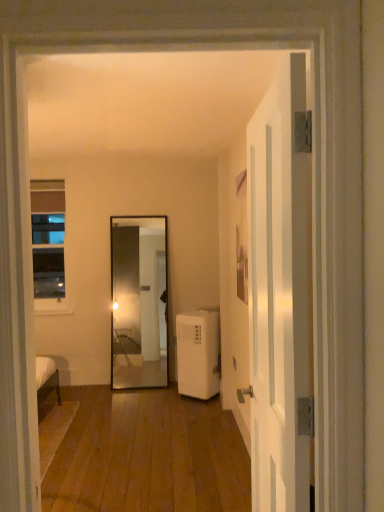
The image size is (384, 512). Describe the element at coordinates (281, 294) in the screenshot. I see `white glossy door at right` at that location.

The width and height of the screenshot is (384, 512). What are the coordinates of `white glossy door at right` in the screenshot? It's located at (281, 294).

Is white plastic air conditioner at lower right a part of white glossy door at right?

That's incorrect, white plastic air conditioner at lower right is not inside white glossy door at right.

Which of these two, white glossy door at right or white plastic air conditioner at lower right, is wider?

white plastic air conditioner at lower right.

Where is `air conditioner on the left of white glossy door at right`? This screenshot has width=384, height=512. air conditioner on the left of white glossy door at right is located at coordinates tap(198, 354).

Is white plastic air conditioner at lower right at the back of white glossy door at right?

No, white plastic air conditioner at lower right is not at the back of white glossy door at right.

From the image's perspective, which is below, white plastic air conditioner at lower right or clear glass window at left?

From the image's view, white plastic air conditioner at lower right is below.

Is white plastic air conditioner at lower right bigger than clear glass window at left?

Correct, white plastic air conditioner at lower right is larger in size than clear glass window at left.

Based on the photo, how much distance is there between white plastic air conditioner at lower right and clear glass window at left?

A distance of 5.40 feet exists between white plastic air conditioner at lower right and clear glass window at left.

Is the position of white plastic air conditioner at lower right less distant than that of clear glass window at left?

Yes.

Does white glossy door at right appear on the left side of clear glass window at left?

Incorrect, white glossy door at right is not on the left side of clear glass window at left.

Does white glossy door at right lie in front of clear glass window at left?

Yes, white glossy door at right is closer to the viewer.

From a real-world perspective, relative to clear glass window at left, is white glossy door at right vertically above or below?

In terms of real-world spatial position, white glossy door at right is below clear glass window at left.

Where is `door in front of the clear glass window at left`? door in front of the clear glass window at left is located at coordinates (281, 294).

Is white plastic air conditioner at lower right oriented away from white glossy door at right?

That's not correct — white plastic air conditioner at lower right is not looking away from white glossy door at right.

Choose the correct answer: Is white plastic air conditioner at lower right inside white glossy door at right or outside it?

white plastic air conditioner at lower right is outside white glossy door at right.

Is point (193, 318) farther from camera compared to point (257, 426)?

Yes.

In the image, there is a white plastic air conditioner at lower right. Where is `door above it (from the image's perspective)`? This screenshot has width=384, height=512. door above it (from the image's perspective) is located at coordinates (281, 294).

Is the depth of clear glass window at left greater than that of white plastic air conditioner at lower right?

Yes, it is.

In terms of height, does clear glass window at left look taller or shorter compared to white plastic air conditioner at lower right?

Considering their sizes, clear glass window at left has more height than white plastic air conditioner at lower right.

Based on their sizes in the image, would you say clear glass window at left is bigger or smaller than white plastic air conditioner at lower right?

Clearly, clear glass window at left is smaller in size than white plastic air conditioner at lower right.

In the image, is clear glass window at left on the left side or the right side of white plastic air conditioner at lower right?

From the image, it's evident that clear glass window at left is to the left of white plastic air conditioner at lower right.

Looking at this image, which object is positioned more to the left, clear glass window at left or white glossy door at right?

clear glass window at left.

Is clear glass window at left positioned far away from white glossy door at right?

Yes, clear glass window at left and white glossy door at right are quite far apart.

Does clear glass window at left have a lesser height compared to white glossy door at right?

Indeed, clear glass window at left has a lesser height compared to white glossy door at right.

From a real-world perspective, is clear glass window at left under white glossy door at right?

No, from a real-world perspective, clear glass window at left is not beneath white glossy door at right.

Locate an element on the screen. air conditioner below the white glossy door at right (from a real-world perspective) is located at coordinates (198, 354).

Find the location of a particular element. air conditioner lying on the right of clear glass window at left is located at coordinates (198, 354).

When comparing their distances from white glossy door at right, does clear glass window at left or white plastic air conditioner at lower right seem further?

Among the two, clear glass window at left is located further to white glossy door at right.

From the image, which object appears to be farther from white glossy door at right, white plastic air conditioner at lower right or clear glass window at left?

clear glass window at left is further to white glossy door at right.

Looking at the image, which one is located closer to white plastic air conditioner at lower right, clear glass window at left or white glossy door at right?

The object closer to white plastic air conditioner at lower right is clear glass window at left.

Considering their positions, is white glossy door at right positioned further to clear glass window at left than white plastic air conditioner at lower right?

white glossy door at right.

From the image, which object appears to be nearer to white plastic air conditioner at lower right, white glossy door at right or clear glass window at left?

clear glass window at left.

Considering their positions, is white plastic air conditioner at lower right positioned closer to clear glass window at left than white glossy door at right?

Among the two, white plastic air conditioner at lower right is located nearer to clear glass window at left.

Where is `air conditioner between white glossy door at right and clear glass window at left along the z-axis`? air conditioner between white glossy door at right and clear glass window at left along the z-axis is located at coordinates (198, 354).